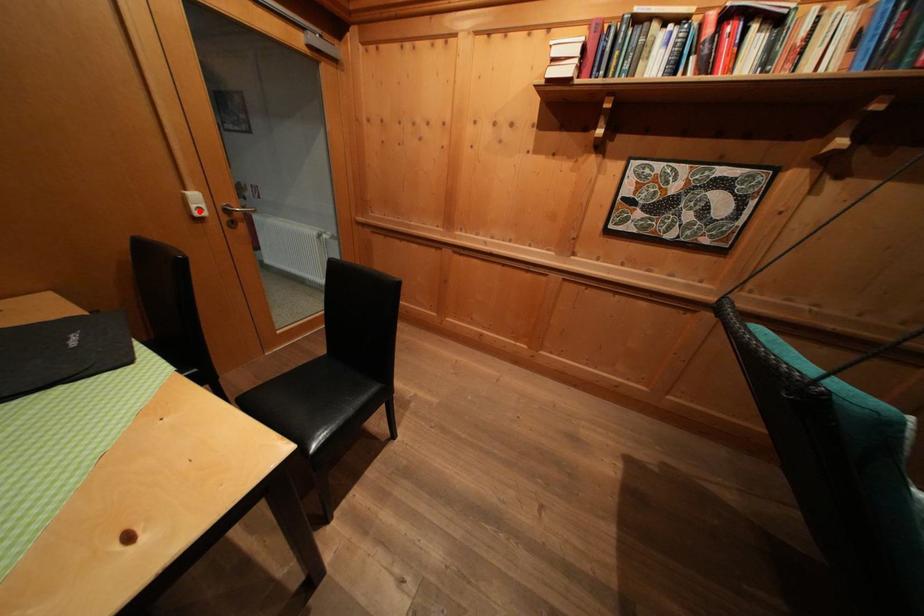
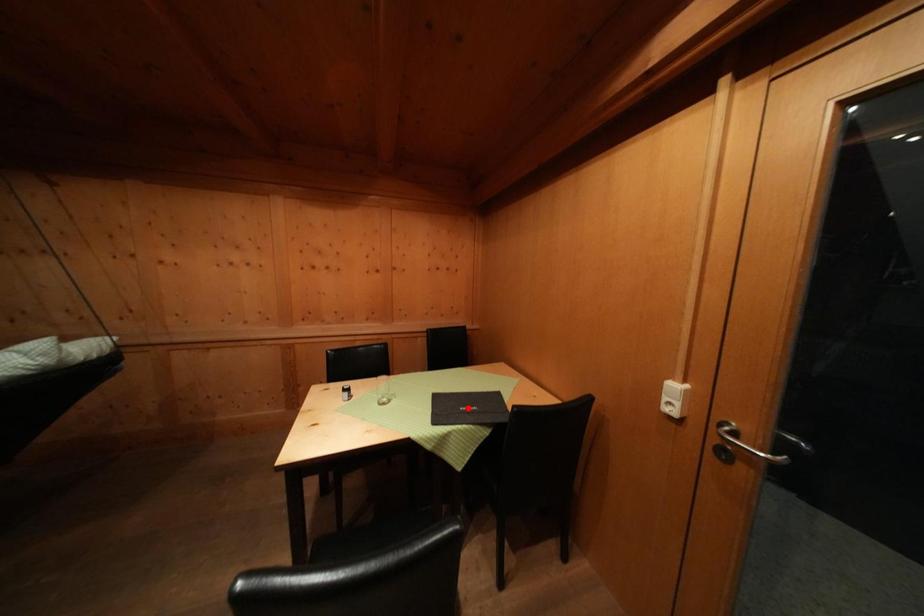
I am providing you with two images of the same scene from different viewpoints. A red point is marked on the first image and another point is marked on the second image. Are the points marked in image1 and image2 representing the same 3D position?

No